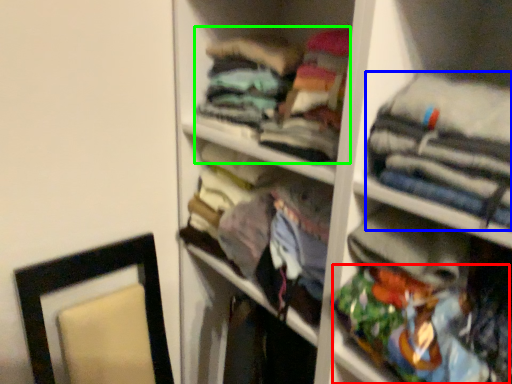
Question: Based on their relative distances, which object is nearer to clothing (highlighted by a red box)? Choose from clothing (highlighted by a blue box) and clothing (highlighted by a green box).

Choices:
 (A) clothing
 (B) clothing

Answer: (A)